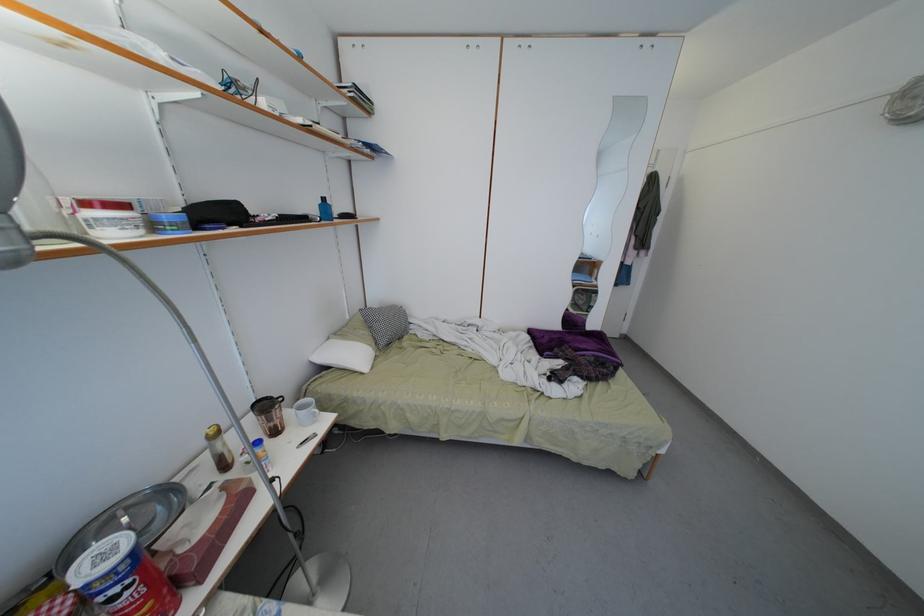
Locate an element on the screen. The image size is (924, 616). blue lidded container is located at coordinates pos(169,223).